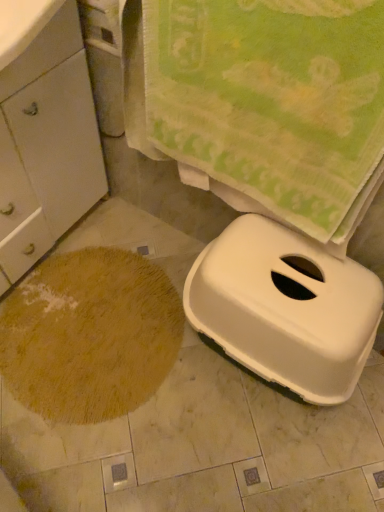
What are the coordinates of `free space in front of white plastic litter box at lower right` in the screenshot? It's located at (242, 455).